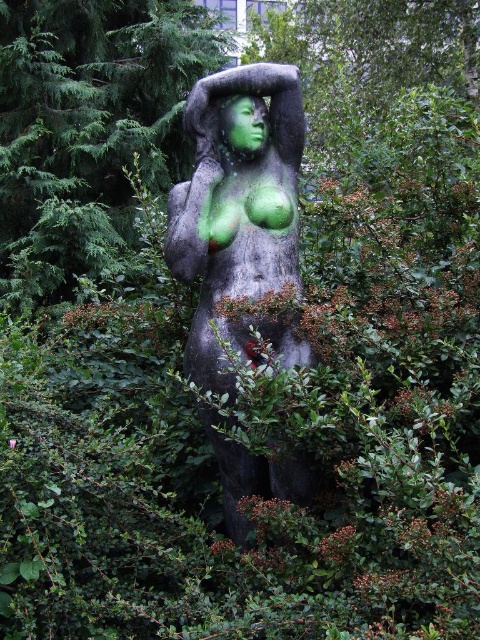
Is green matte statue at center above green matte face at center?

Yes.

What do you see at coordinates (87, 129) in the screenshot? The image size is (480, 640). I see `green matte statue at center` at bounding box center [87, 129].

Identify the location of green matte statue at center. (87, 129).

Who is more distant from viewer, (300, 90) or (240, 141)?

Positioned behind is point (300, 90).

In order to click on green stone statue at center in this screenshot , I will do `click(236, 211)`.

Does point (264, 282) come behind point (231, 134)?

That is False.

Locate an element on the screen. This screenshot has height=640, width=480. green stone statue at center is located at coordinates click(236, 211).

Can you confirm if green matte statue at center is positioned below green stone statue at center?

Incorrect, green matte statue at center is not positioned below green stone statue at center.

Between green matte statue at center and green stone statue at center, which one appears on the right side from the viewer's perspective?

green stone statue at center is more to the right.

Find the location of a particular element. Image resolution: width=480 pixels, height=640 pixels. green matte statue at center is located at coordinates (87, 129).

Find the location of a particular element. The height and width of the screenshot is (640, 480). green matte statue at center is located at coordinates (87, 129).